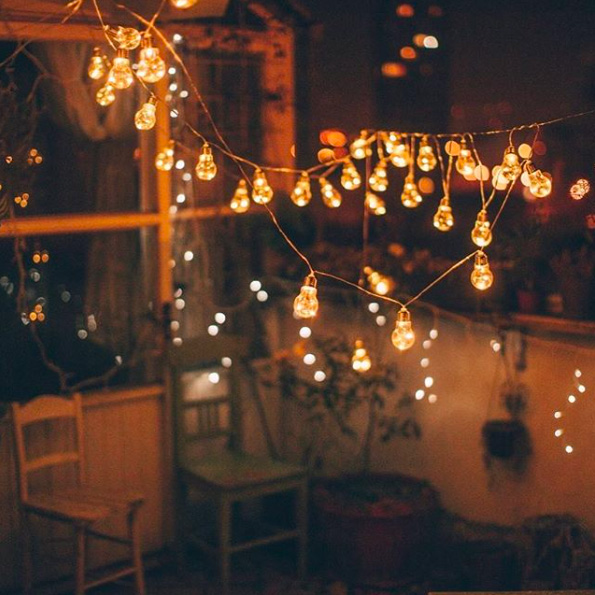
This screenshot has width=595, height=595. Identify the location of blue chair. (228, 472).